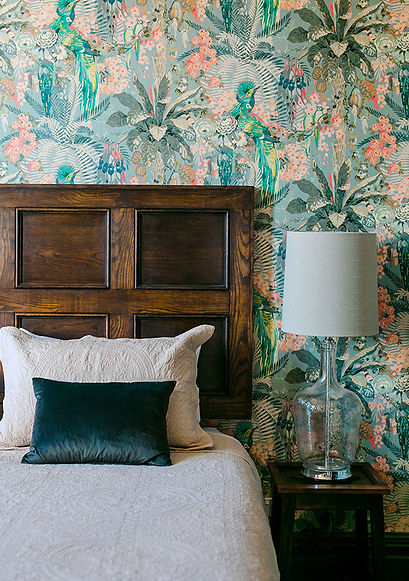
Find the location of a particular element. lamp is located at coordinates (350, 313).